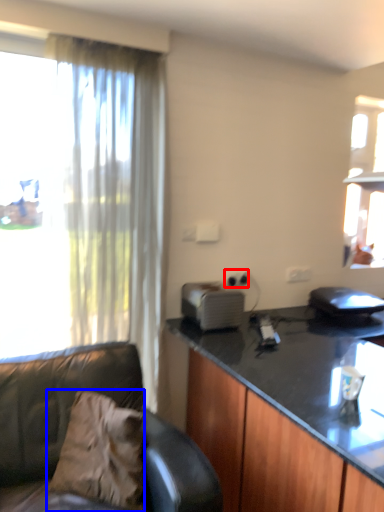
Question: Among these objects, which one is farthest to the camera, power outlet (highlighted by a red box) or pillow (highlighted by a blue box)?

Choices:
 (A) power outlet
 (B) pillow

Answer: (A)